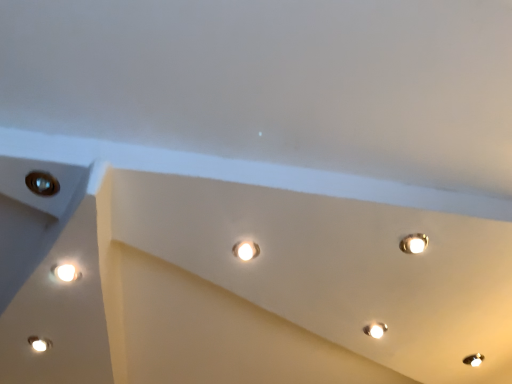
Question: Is matte white droplight at center not close to matte white lamp at lower left, acting as the 1th lamp starting from the front?

Choices:
 (A) yes
 (B) no

Answer: (B)

Question: Is matte white droplight at center shorter than matte white lamp at lower left, acting as the 1th lamp starting from the front?

Choices:
 (A) yes
 (B) no

Answer: (B)

Question: Is matte white droplight at center aimed at matte white lamp at lower left, which is counted as the first lamp, starting from the left?

Choices:
 (A) yes
 (B) no

Answer: (B)

Question: Considering the relative sizes of matte white droplight at center and matte white lamp at lower left, which appears as the second lamp when viewed from the back, in the image provided, is matte white droplight at center bigger than matte white lamp at lower left, which appears as the second lamp when viewed from the back,?

Choices:
 (A) no
 (B) yes

Answer: (B)

Question: From the image's perspective, is matte white droplight at center over matte white lamp at lower left, acting as the second lamp starting from the right?

Choices:
 (A) no
 (B) yes

Answer: (B)

Question: From a real-world perspective, is matte white droplight at center positioned above or below matte white lamp at lower left, acting as the second lamp starting from the right?

Choices:
 (A) above
 (B) below

Answer: (A)

Question: Is point (247, 246) closer or farther from the camera than point (33, 336)?

Choices:
 (A) farther
 (B) closer

Answer: (B)

Question: Is matte white droplight at center inside the boundaries of matte white lamp at lower left, acting as the 1th lamp starting from the front, or outside?

Choices:
 (A) outside
 (B) inside

Answer: (A)

Question: From their relative heights in the image, would you say matte white droplight at center is taller or shorter than matte white lamp at lower left, acting as the second lamp starting from the right?

Choices:
 (A) short
 (B) tall

Answer: (B)

Question: Is matte white droplight at center to the left or to the right of white glossy lamp at lower right, acting as the second lamp starting from the front, in the image?

Choices:
 (A) right
 (B) left

Answer: (B)

Question: Considering their positions, is matte white droplight at center located in front of or behind white glossy lamp at lower right, acting as the second lamp starting from the front?

Choices:
 (A) front
 (B) behind

Answer: (A)

Question: Considering the positions of point (232, 248) and point (373, 334), is point (232, 248) closer or farther from the camera than point (373, 334)?

Choices:
 (A) farther
 (B) closer

Answer: (B)

Question: Is matte white droplight at center wider or thinner than white glossy lamp at lower right, the 2th lamp from the left?

Choices:
 (A) wide
 (B) thin

Answer: (B)

Question: From the image's perspective, is matte white lamp at lower left, which appears as the second lamp when viewed from the back, above or below white glossy lamp at lower right, the 2th lamp from the left?

Choices:
 (A) below
 (B) above

Answer: (A)

Question: Looking at their shapes, would you say matte white lamp at lower left, acting as the second lamp starting from the right, is wider or thinner than white glossy lamp at lower right, the 1th lamp positioned from the back?

Choices:
 (A) wide
 (B) thin

Answer: (B)